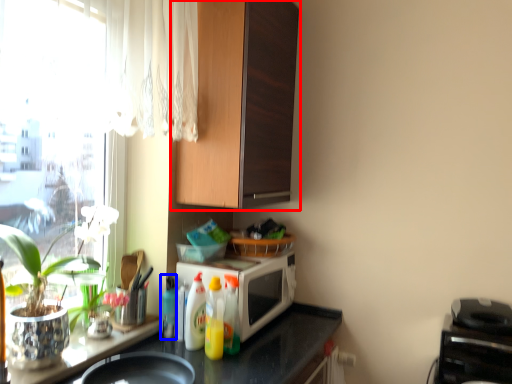
Question: Which object is further to the camera taking this photo, cabinetry (highlighted by a red box) or bottle (highlighted by a blue box)?

Choices:
 (A) cabinetry
 (B) bottle

Answer: (B)